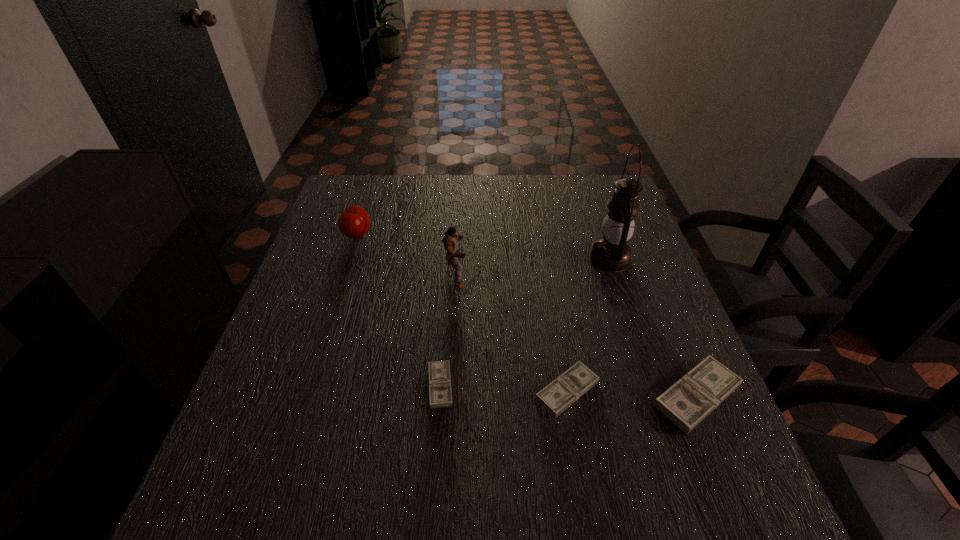
Find the location of a particular element. This screenshot has width=960, height=540. free spot at the far edge of the desktop is located at coordinates (438, 193).

Image resolution: width=960 pixels, height=540 pixels. Identify the location of vacant position at the near edge of the desktop. (547, 446).

In the image, there is a desktop. Find the location of `blank space at the left edge`. blank space at the left edge is located at coordinates (333, 361).

Locate an element on the screen. vacant space at the right edge is located at coordinates (654, 336).

Where is `vacant space at the far left corner`? The height and width of the screenshot is (540, 960). vacant space at the far left corner is located at coordinates (377, 200).

The height and width of the screenshot is (540, 960). In the image, there is a desktop. Find the location of `vacant space at the far right corner`. vacant space at the far right corner is located at coordinates (610, 179).

Where is `unoccupied position between the tallest money and the third object from right to left`? This screenshot has height=540, width=960. unoccupied position between the tallest money and the third object from right to left is located at coordinates (632, 393).

The image size is (960, 540). In order to click on empty space that is in between the oil lamp and the shortest money in this screenshot , I will do `click(525, 322)`.

Where is `unoccupied area between the puncher and the oil lamp`? This screenshot has height=540, width=960. unoccupied area between the puncher and the oil lamp is located at coordinates (533, 267).

This screenshot has height=540, width=960. What are the coordinates of `empty location between the tallest object and the fifth shortest object` in the screenshot? It's located at (533, 267).